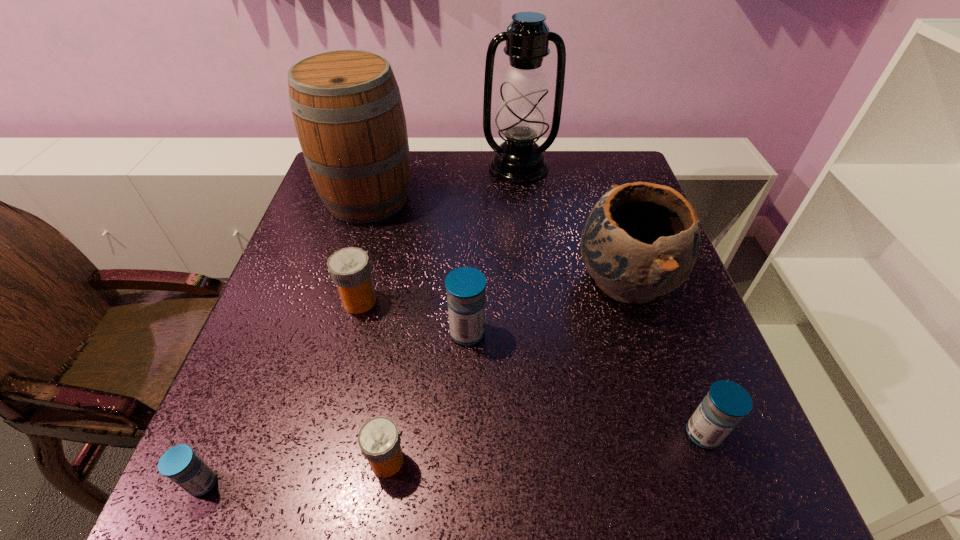
Identify the location of free space that satisfies the following two spatial constraints: 1. on the back side of the rightmost medicine; 2. on the label side of the second medicine from left to right. (655, 301).

The height and width of the screenshot is (540, 960). Find the location of `vacant position in the image that satisfies the following two spatial constraints: 1. on the front side of the rightmost blue medicine; 2. on the label side of the third medicine from left to right`. vacant position in the image that satisfies the following two spatial constraints: 1. on the front side of the rightmost blue medicine; 2. on the label side of the third medicine from left to right is located at coordinates (712, 461).

Find the location of a particular element. This screenshot has width=960, height=540. vacant space that satisfies the following two spatial constraints: 1. on the front side of the second biggest blue medicine; 2. on the left side of the seventh shortest object is located at coordinates (298, 434).

Where is `free spot that satisfies the following two spatial constraints: 1. on the label side of the second farthest medicine; 2. on the right side of the bigger orange medicine`? Image resolution: width=960 pixels, height=540 pixels. free spot that satisfies the following two spatial constraints: 1. on the label side of the second farthest medicine; 2. on the right side of the bigger orange medicine is located at coordinates (351, 333).